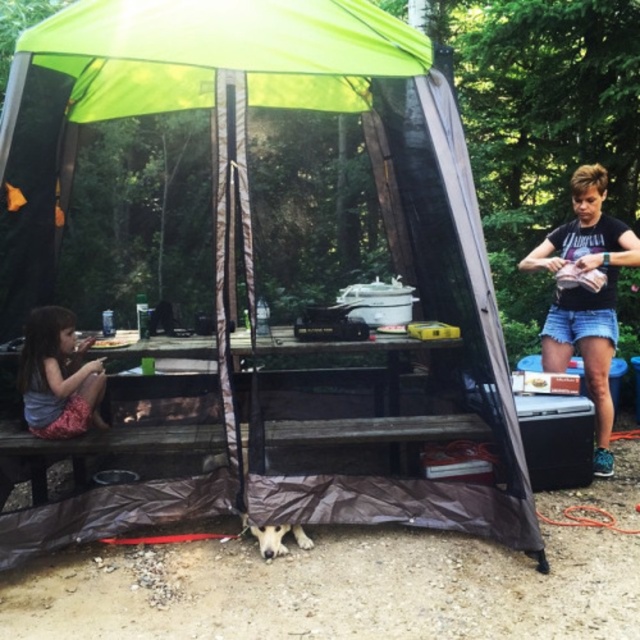
You are a hiker who wants to place a new item at the point marked by the coordinates point (586, 296). What object is currently occupying that location?

The black denim shorts at right is located at point (586, 296).

You are a photographer setting up a shot of the black denim shorts at right and the matte pink dress at lower left. To ensure both are in focus, you need to know their vertical positions. Which one is higher up in the frame?

The black denim shorts at right is located above the matte pink dress at lower left, so it is higher up in the frame.